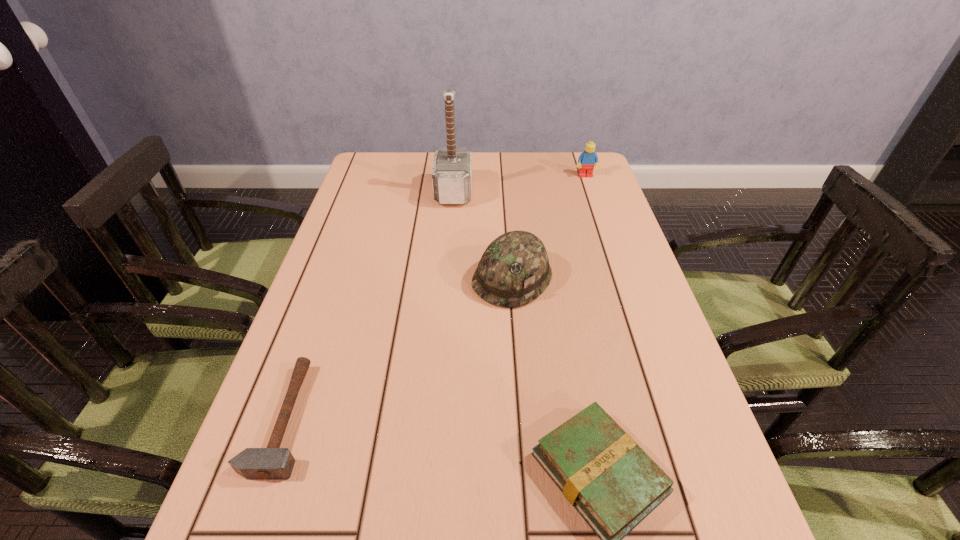
Locate an element on the screen. free space between the headwear and the Lego is located at coordinates (549, 227).

This screenshot has height=540, width=960. What are the coordinates of `free space between the tallest object and the third farthest object` in the screenshot? It's located at (483, 235).

Identify which object is located as the fourth nearest to the Lego. Please provide its 2D coordinates. Your answer should be formatted as a tuple, i.e. [(x, y)], where the tuple contains the x and y coordinates of a point satisfying the conditions above.

[(272, 463)]

Find the location of a particular element. The height and width of the screenshot is (540, 960). object that is the fourth closest to the third nearest object is located at coordinates (588, 158).

Locate an element on the screen. This screenshot has width=960, height=540. free location that satisfies the following two spatial constraints: 1. on the face of the Lego; 2. on the striking surface of the shortest object is located at coordinates (667, 418).